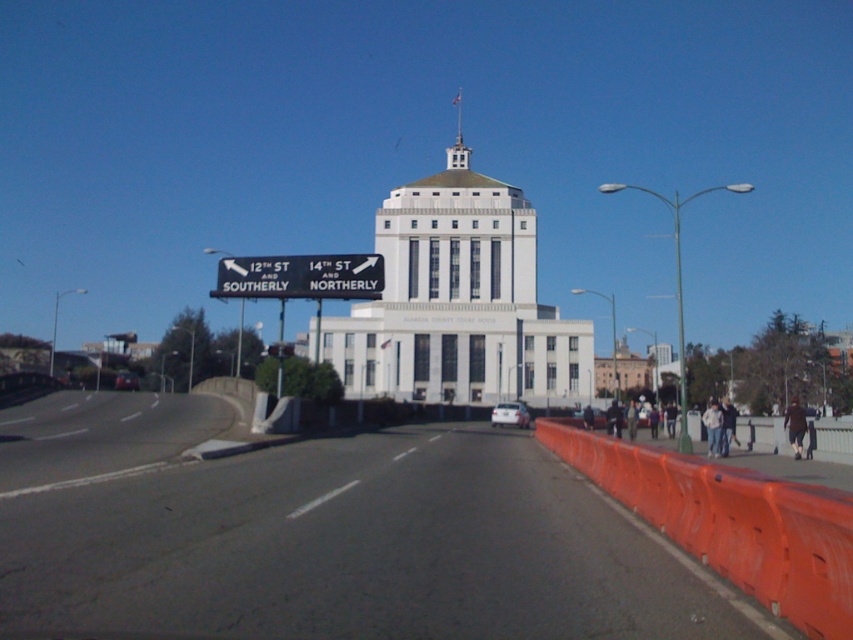
You are driving a car and see the shiny red car at center and the black plastic sign at upper center. Which object is wider?

The shiny red car at center is wider than the black plastic sign at upper center.

You are driving north on 12th St and see the white concrete building at center and the black plastic sign at upper center. Which object would you see first as you approach the intersection?

The black plastic sign at upper center would be seen first because it is closer to the road than the white concrete building at center, which is further away in the distance.